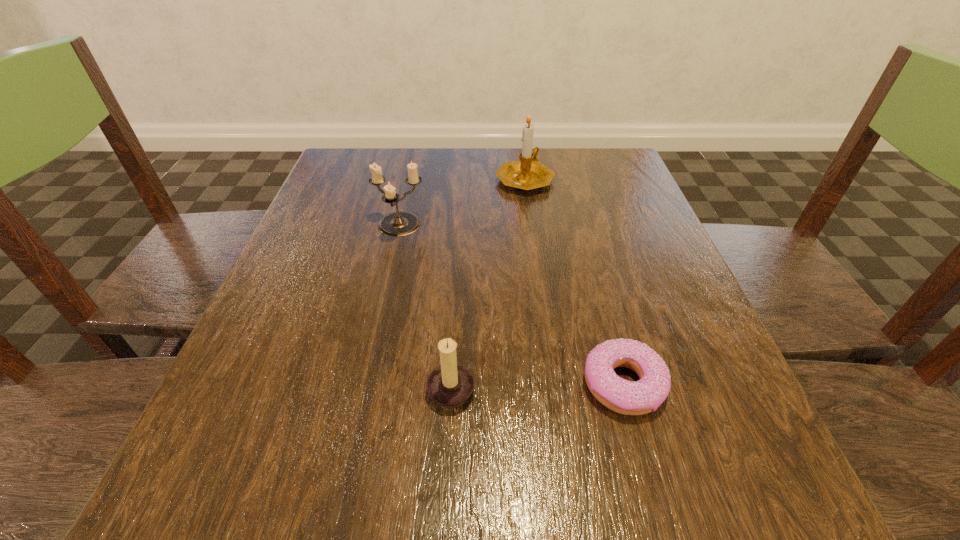
Image resolution: width=960 pixels, height=540 pixels. In order to click on vacant space located 0.360m on the back of the doughnut in this screenshot , I will do `click(577, 214)`.

This screenshot has height=540, width=960. Identify the location of object that is positioned at the far edge. (526, 174).

Where is `object present at the left edge`? Image resolution: width=960 pixels, height=540 pixels. object present at the left edge is located at coordinates (400, 223).

Where is `object that is at the right edge`? Image resolution: width=960 pixels, height=540 pixels. object that is at the right edge is located at coordinates (640, 397).

Identify the location of vacant region at the far edge of the desktop. The image size is (960, 540). (566, 198).

At what (x,y) coordinates should I click in order to perform the action: click on vacant area at the left edge. Please return your answer as a coordinate pair (x, y). The width and height of the screenshot is (960, 540). Looking at the image, I should click on (298, 260).

Where is `free region at the right edge of the desktop`? free region at the right edge of the desktop is located at coordinates (735, 391).

Locate an element on the screen. The width and height of the screenshot is (960, 540). blank space at the far left corner is located at coordinates (360, 153).

Locate an element on the screen. empty space between the nearest candle holder and the shortest object is located at coordinates (537, 383).

Find the location of a particular element. Image resolution: width=960 pixels, height=540 pixels. free space between the doughnut and the farthest candle holder is located at coordinates (574, 280).